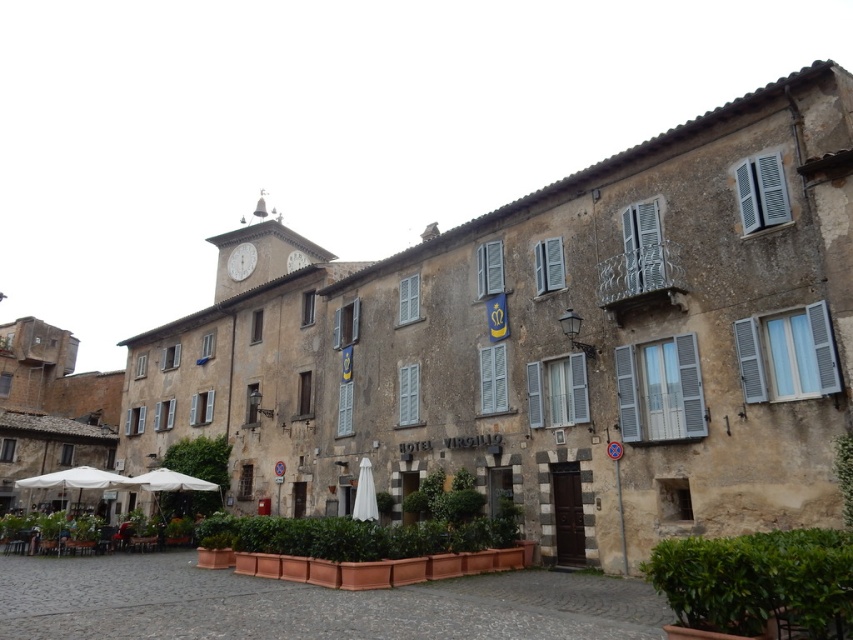
You are a tourist standing in the plaza in front of the historic hotel. You want to take a photo of the white stone clock at upper center but need to avoid the white fabric umbrella at center blocking the view. Can the umbrella be moved to the side without overlapping the clock?

The white fabric umbrella at center is narrower than the white stone clock at upper center. Since the umbrella is smaller in width, it can be moved to the side so that it doesn not overlap the clock.

You are a tourist standing in the plaza in front of the Hotel Virgilio. You notice a white fabric umbrella at center and a white stone clock at upper center. Which object is taller?

The white stone clock at upper center is taller than the white fabric umbrella at center.